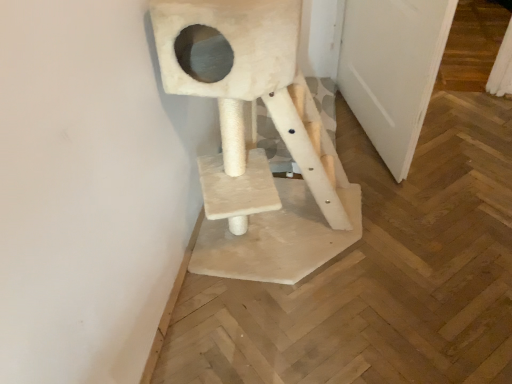
The image size is (512, 384). What are the coordinates of `free space underneath sanded wood cat tree at center (from a real-world perspective)` in the screenshot? It's located at [x=282, y=237].